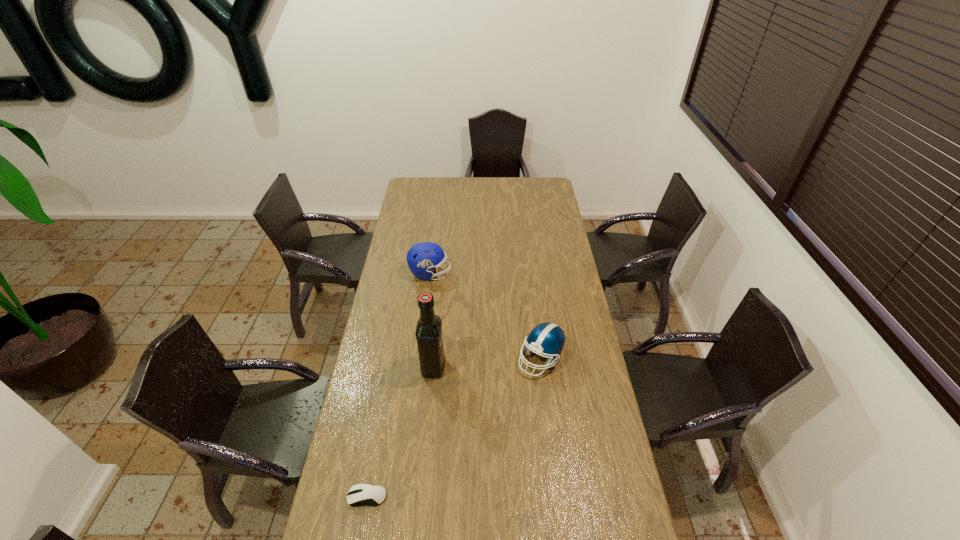
Locate an element on the screen. Image resolution: width=960 pixels, height=540 pixels. vacant position in the image that satisfies the following two spatial constraints: 1. at the front of the rightmost object with the faceguard; 2. on the front-facing side of the liquor is located at coordinates (541, 367).

Locate an element on the screen. This screenshot has height=540, width=960. free space that satisfies the following two spatial constraints: 1. at the front of the nearer football helmet with the faceguard; 2. on the front-facing side of the liquor is located at coordinates (541, 367).